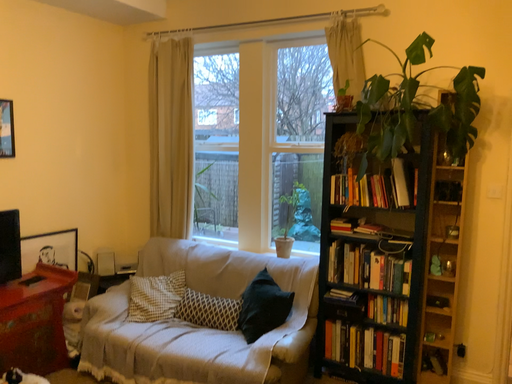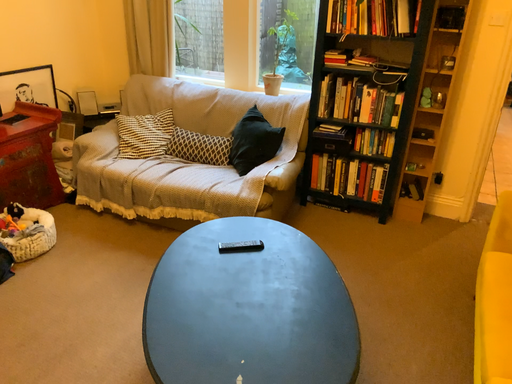
Question: Which way did the camera rotate in the video?

Choices:
 (A) rotated downward
 (B) rotated upward

Answer: (A)